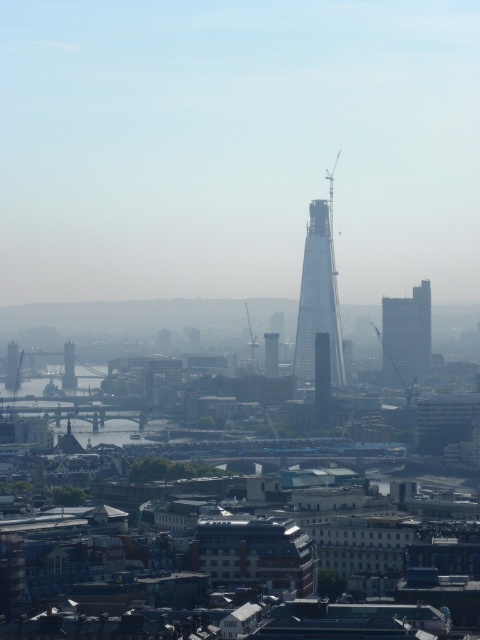
Question: Which of the following is the closest to the observer?

Choices:
 (A) matte gray building at right
 (B) transparent glass tower at center
 (C) glass skyscraper at center
 (D) silver metallic bridge at left

Answer: (B)

Question: Considering the real-world distances, which object is closest to the glass skyscraper at center?

Choices:
 (A) matte gray building at right
 (B) silver metallic bridge at left

Answer: (A)

Question: Does transparent glass tower at center have a smaller size compared to glass skyscraper at center?

Choices:
 (A) no
 (B) yes

Answer: (A)

Question: Which of the following is the closest to the observer?

Choices:
 (A) transparent glass tower at center
 (B) matte gray building at right
 (C) glass skyscraper at center
 (D) silver metallic bridge at left

Answer: (A)

Question: Observing the image, what is the correct spatial positioning of transparent glass tower at center in reference to silver metallic bridge at left?

Choices:
 (A) above
 (B) below

Answer: (A)

Question: Does transparent glass tower at center appear over matte gray building at right?

Choices:
 (A) no
 (B) yes

Answer: (B)